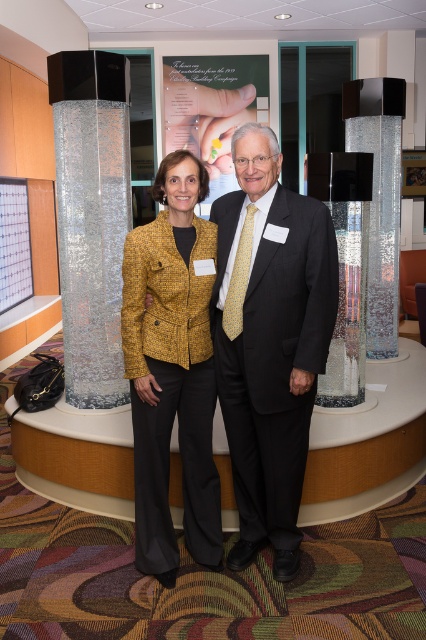
Can you confirm if yellow textured blazer at center is positioned below clear glass pillar at right?

Yes, yellow textured blazer at center is below clear glass pillar at right.

Who is more forward, (158, 328) or (351, 358)?

Positioned in front is point (158, 328).

Where is `yellow textured blazer at center`? yellow textured blazer at center is located at coordinates (172, 371).

Does yellow textured blazer at center appear on the right side of sparkly silver column at center?

Correct, you'll find yellow textured blazer at center to the right of sparkly silver column at center.

The image size is (426, 640). What do you see at coordinates (172, 371) in the screenshot?
I see `yellow textured blazer at center` at bounding box center [172, 371].

The height and width of the screenshot is (640, 426). I want to click on yellow textured blazer at center, so click(x=172, y=371).

This screenshot has height=640, width=426. What do you see at coordinates (172, 371) in the screenshot?
I see `yellow textured blazer at center` at bounding box center [172, 371].

Is yellow textured blazer at center below clear glass cylinder at center?

Correct, yellow textured blazer at center is located below clear glass cylinder at center.

Who is more distant from viewer, [215,518] or [386,220]?

Point [386,220]

What are the coordinates of `yellow textured blazer at center` in the screenshot? It's located at (172, 371).